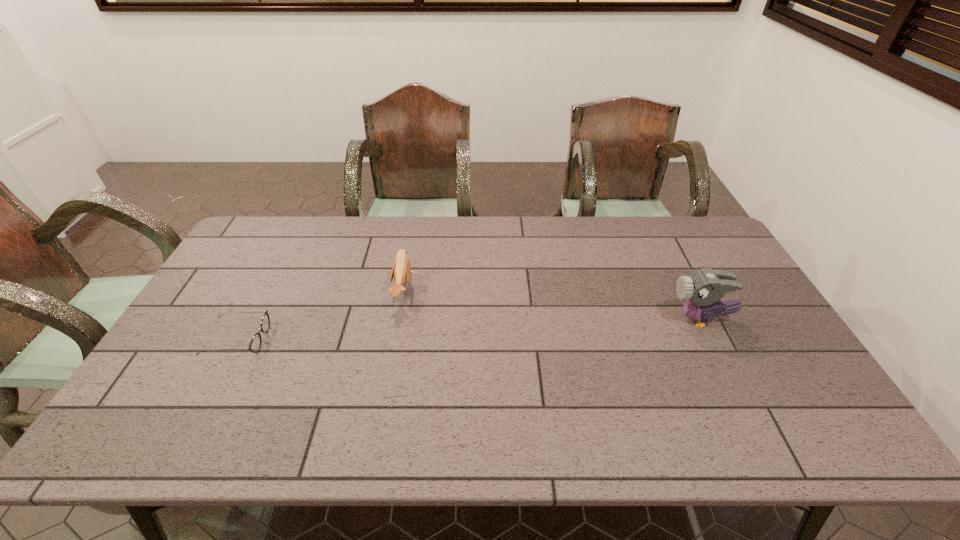
At what (x,y) coordinates should I click in order to perform the action: click on the tallest object. Please return your answer as a coordinate pair (x, y). Looking at the image, I should click on (703, 288).

At what (x,y) coordinates should I click in order to perform the action: click on the rightmost object. Please return your answer as a coordinate pair (x, y). The image size is (960, 540). Looking at the image, I should click on (703, 288).

The width and height of the screenshot is (960, 540). Identify the location of the left bird. (401, 271).

Locate an element on the screen. Image resolution: width=960 pixels, height=540 pixels. the shorter bird is located at coordinates (401, 271).

Where is `spectacles`? This screenshot has width=960, height=540. spectacles is located at coordinates tap(255, 344).

At what (x,y) coordinates should I click in order to perform the action: click on the shortest object. Please return your answer as a coordinate pair (x, y). This screenshot has width=960, height=540. Looking at the image, I should click on (255, 344).

Image resolution: width=960 pixels, height=540 pixels. Find the location of `vacant position located 0.380m at the beak of the taller bird`. vacant position located 0.380m at the beak of the taller bird is located at coordinates (536, 319).

The height and width of the screenshot is (540, 960). Identify the location of free point located 0.390m at the beak of the taller bird. (533, 319).

Where is `free spot located at the beak of the taller bird`? The width and height of the screenshot is (960, 540). free spot located at the beak of the taller bird is located at coordinates (561, 319).

At what (x,y) coordinates should I click in order to perform the action: click on vacant space situated 0.260m at the beak of the second object from right to left. Please return your answer as a coordinate pair (x, y). The width and height of the screenshot is (960, 540). Looking at the image, I should click on (498, 291).